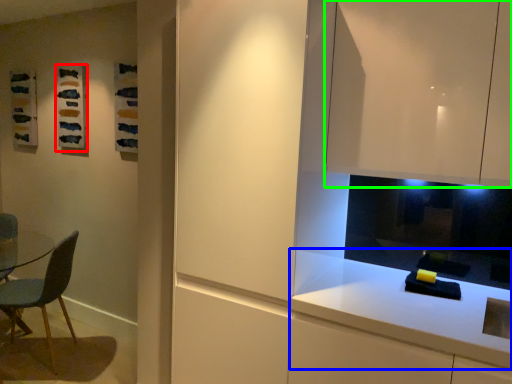
Question: Which object is positioned closest to art (highlighted by a red box)? Select from countertop (highlighted by a blue box) and cabinetry (highlighted by a green box).

Choices:
 (A) countertop
 (B) cabinetry

Answer: (B)